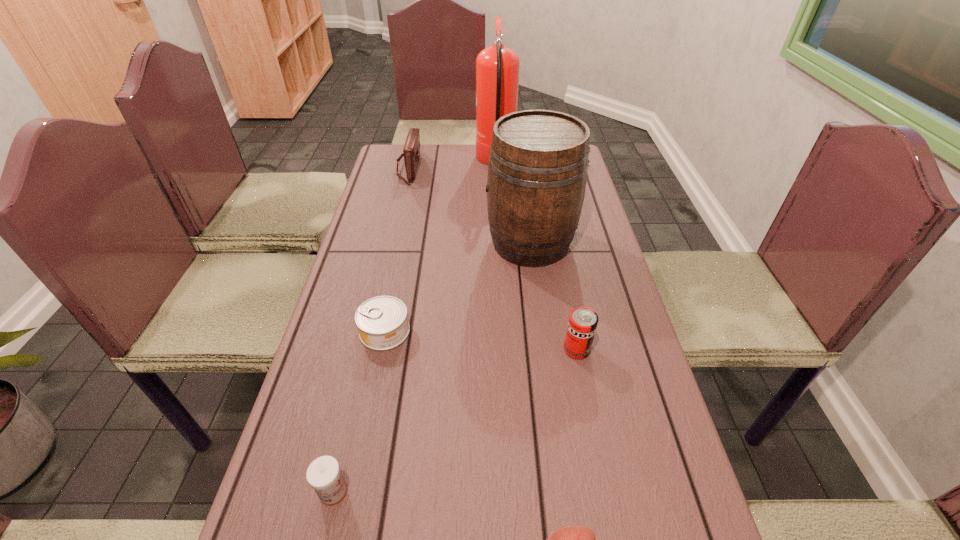
Locate an element on the screen. The width and height of the screenshot is (960, 540). the tallest object is located at coordinates (497, 67).

This screenshot has width=960, height=540. I want to click on the fifth nearest object, so click(x=538, y=162).

Locate an element on the screen. cider is located at coordinates (538, 162).

Find the location of `shoulder bag`. shoulder bag is located at coordinates (411, 151).

Image resolution: width=960 pixels, height=540 pixels. I want to click on the right can, so click(583, 321).

In order to click on the second nearest object in this screenshot , I will do `click(323, 474)`.

Locate an element on the screen. The height and width of the screenshot is (540, 960). the sixth tallest object is located at coordinates (323, 474).

In order to click on the left can in this screenshot , I will do `click(382, 322)`.

You are a GUI agent. You are given a task and a screenshot of the screen. Output one action in this format:
    pyautogui.click(x=<x>, y=<y>)
    Task: Click on the shorter can
    Image resolution: width=960 pixels, height=540 pixels.
    Given the screenshot: What is the action you would take?
    pyautogui.click(x=382, y=322)

Find the location of `free space located towards the nozzle of the fire extinguisher`. free space located towards the nozzle of the fire extinguisher is located at coordinates (430, 162).